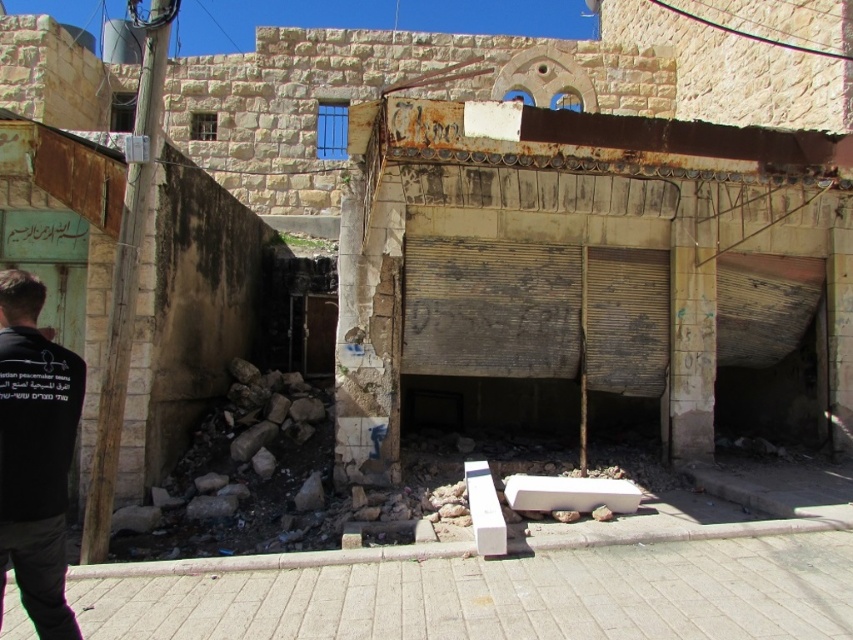
Question: Is white concrete wall at lower center below black fabric shirt at left?

Choices:
 (A) no
 (B) yes

Answer: (B)

Question: Is white concrete wall at lower center to the left of black fabric shirt at left from the viewer's perspective?

Choices:
 (A) no
 (B) yes

Answer: (B)

Question: Which point appears closest to the camera in this image?

Choices:
 (A) (793, 636)
 (B) (59, 440)

Answer: (B)

Question: Which point is closer to the camera?

Choices:
 (A) white concrete wall at lower center
 (B) black fabric shirt at left

Answer: (B)

Question: Which point is closer to the camera taking this photo?

Choices:
 (A) (345, 584)
 (B) (15, 364)

Answer: (B)

Question: Is white concrete wall at lower center further to camera compared to black fabric shirt at left?

Choices:
 (A) yes
 (B) no

Answer: (A)